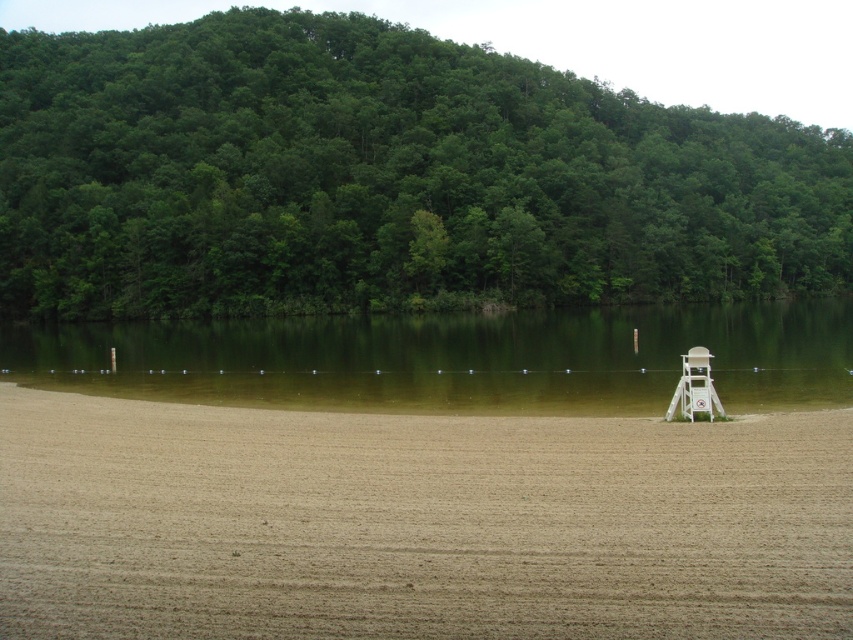
Question: Among these objects, which one is nearest to the camera?

Choices:
 (A) green smooth water at center
 (B) green leafy trees at upper center

Answer: (A)

Question: Which point is closer to the camera taking this photo?

Choices:
 (A) (86, 612)
 (B) (646, 332)
 (C) (163, 140)

Answer: (A)

Question: Does green leafy trees at upper center have a smaller size compared to green smooth water at center?

Choices:
 (A) yes
 (B) no

Answer: (B)

Question: Estimate the real-world distances between objects in this image. Which object is farther from the green smooth water at center?

Choices:
 (A) green leafy trees at upper center
 (B) brown sandy beach at center

Answer: (A)

Question: Can you confirm if green leafy trees at upper center is smaller than brown sandy beach at center?

Choices:
 (A) yes
 (B) no

Answer: (B)

Question: Can you confirm if green leafy trees at upper center is thinner than green smooth water at center?

Choices:
 (A) yes
 (B) no

Answer: (B)